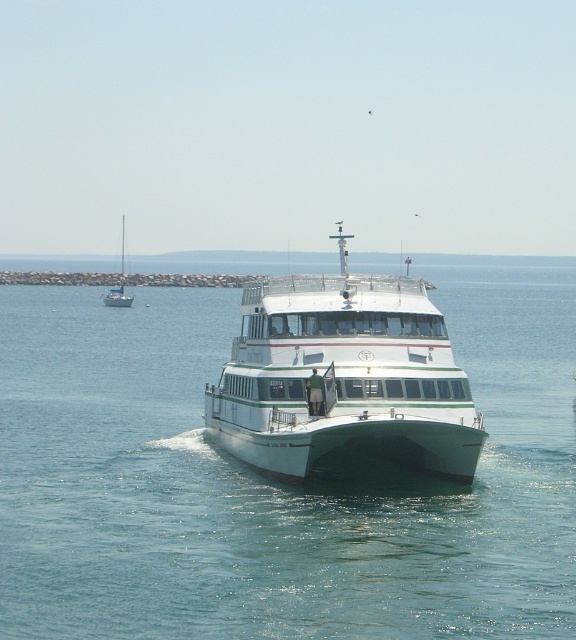
You are a photographer on a helicopter above the water. You need to capture both the white glossy cruise ship at center and the white glossy sailboat at left in a single photo. Which object should you focus on first to ensure both are in frame?

The white glossy cruise ship at center is smaller than the white glossy sailboat at left, so you should focus on the white glossy sailboat at left first to ensure both fit within the frame.

You are a passenger on the white glossy cruise ship at center and want to take a photo of the white glossy sailboat at left. Based on their positions, will the sailboat appear above or below the cruise ship in the photo?

The white glossy cruise ship at center is positioned under the white glossy sailboat at left, so the sailboat will appear above the cruise ship in the photo.